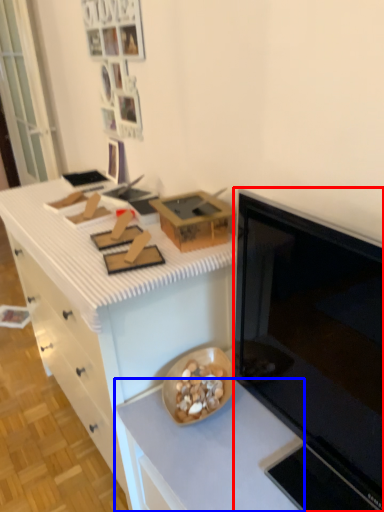
Question: Which object appears closest to the camera in this image, microwave oven (highlighted by a red box) or countertop (highlighted by a blue box)?

Choices:
 (A) microwave oven
 (B) countertop

Answer: (A)